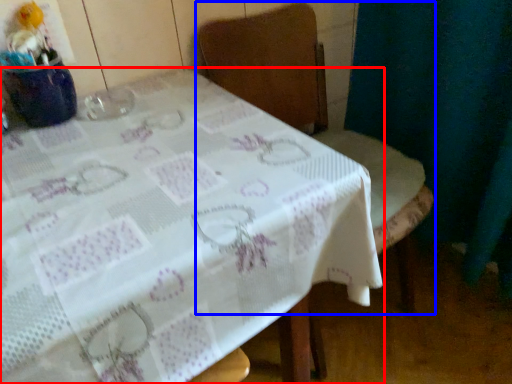
Question: Which of the following is the farthest to the observer, table (highlighted by a red box) or chair (highlighted by a blue box)?

Choices:
 (A) table
 (B) chair

Answer: (B)